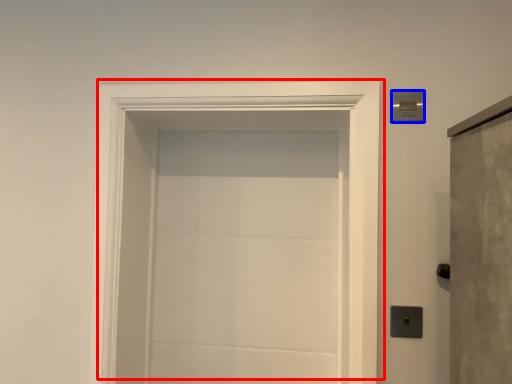
Question: Which object is further to the camera taking this photo, door (highlighted by a red box) or light switch (highlighted by a blue box)?

Choices:
 (A) door
 (B) light switch

Answer: (B)